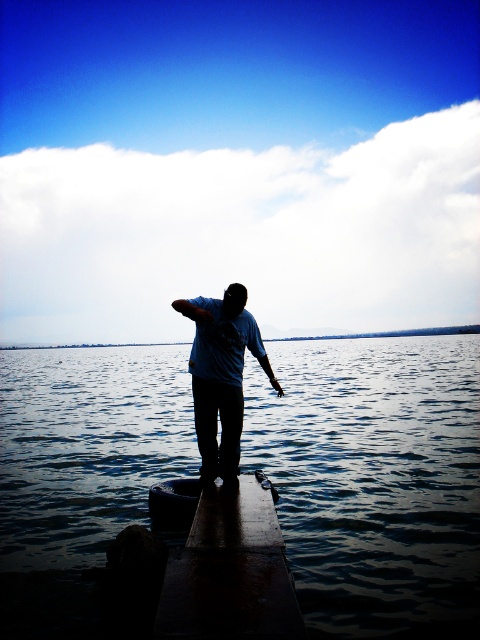
You are a photographer trying to capture the scene. You notice the dark wood dock at center and the matte blue shirt at center. Which object is shorter in height?

The dark wood dock at center is shorter in height than the matte blue shirt at center.

You are a photographer trying to capture the reflection of the matte blue shirt at center on the dark blue water at center. Based on their positions, can you confirm if the reflection will be visible in the water?

The dark blue water at center is closer to the viewer than the matte blue shirt at center. Since the water is closer, the reflection of the matte blue shirt at center would appear behind the water, making it difficult to see the reflection clearly in the water.